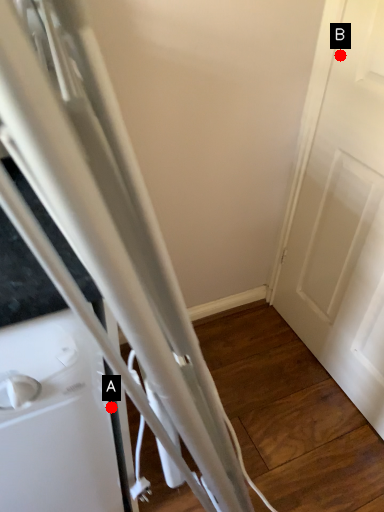
Question: Two points are circled on the image, labeled by A and B beside each circle. Which point is closer to the camera?

Choices:
 (A) A is closer
 (B) B is closer

Answer: (A)